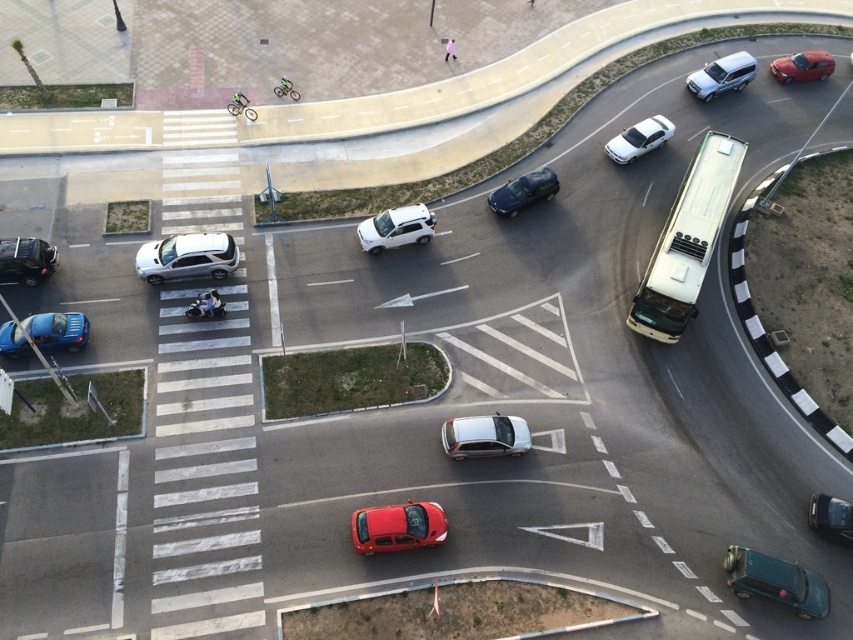
You are a delivery drone flying above the intersection. Your GPS shows a point at coordinates (397, 525). Which vehicle is closest to this point?

The point at coordinates (397, 525) is on the shiny red sedan at lower center, so the closest vehicle is the shiny red sedan at lower center.

You are a delivery driver in a hurry to reach the destination. You see the shiny red sedan at lower center and the metallic silver bicycle at center. What is the shortest distance you can take between them?

The shortest distance between the shiny red sedan at lower center and the metallic silver bicycle at center is 22.44 meters.

You are a delivery drone operator. Your drone needs to fly from the shiny red sedan at lower center to the matte black bicycle at upper left. The drone has a maximum flight range of 20 meters. Can it make the trip without recharging?

The distance between the shiny red sedan at lower center and the matte black bicycle at upper left is 23.51 meters, which exceeds the drone operator mentioned maximum flight range of 20 meters. Therefore, the drone cannot complete the trip without recharging.